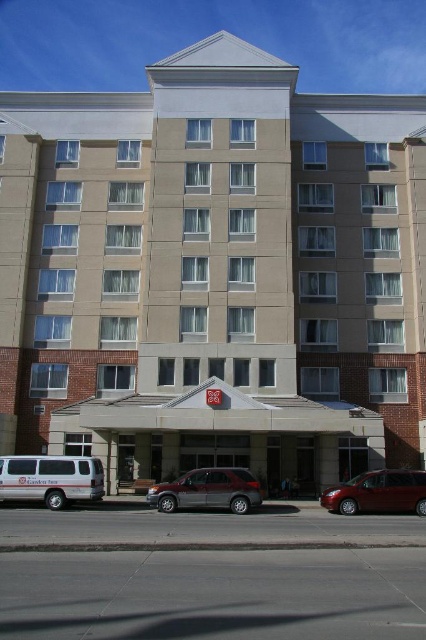
You are standing at the intersection of the street in front of the hotel. You want to take a photo of the beige concrete building at center from a specific angle. What are the coordinates where you should position yourself to capture the building perfectly centered in your camera frame?

To capture the beige concrete building at center perfectly centered, you should position yourself at the coordinates corresponding to the building itself, which is at point (x=213, y=273). This ensures the building is centered in your frame.

You are standing at the entrance of the hotel and want to hail a taxi. There is a white van at lower left located at point (51, 477). If you walk straight ahead from the entrance, will you reach the white van at lower left before reaching the street?

The white van at lower left is located at point (51, 477), which is at the lower left of the image. Since you are at the entrance of the hotel, walking straight ahead would lead you towards the street, which is in front of the hotel. The white van at lower left is positioned at the lower left, so it is likely not on the path straight ahead. Therefore, you would reach the street before the white van at lower left.

You are a photographer trying to capture the entire beige concrete building at center and silver metallic minivan at center in a single frame. Based on their sizes, which object should you focus on to ensure both are visible without cropping?

The beige concrete building at center is bigger than the silver metallic minivan at center. To capture both in a single frame, focus on the beige concrete building at center as the primary subject while ensuring the silver metallic minivan at center is positioned in the foreground or background to maintain visibility without cropping.